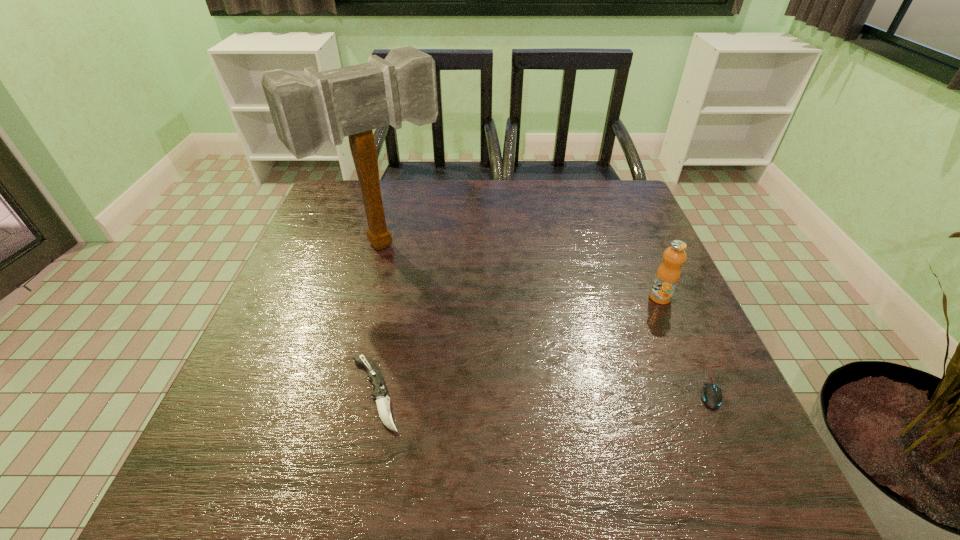
Where is `pocketknife`? The height and width of the screenshot is (540, 960). pocketknife is located at coordinates (380, 393).

Image resolution: width=960 pixels, height=540 pixels. I want to click on mouse, so click(x=712, y=397).

At what (x,y) coordinates should I click in order to perform the action: click on orange juice. Please return your answer as a coordinate pair (x, y). The image size is (960, 540). Looking at the image, I should click on (668, 274).

This screenshot has width=960, height=540. What are the coordinates of `the second farthest object` in the screenshot? It's located at (668, 274).

This screenshot has width=960, height=540. I want to click on the farthest object, so click(x=308, y=110).

At what (x,y) coordinates should I click in order to perform the action: click on the tallest object. Please return your answer as a coordinate pair (x, y). This screenshot has height=540, width=960. Looking at the image, I should click on (308, 110).

You are a GUI agent. You are given a task and a screenshot of the screen. Output one action in this format:
    pyautogui.click(x=<x>, y=<y>)
    Task: Click on the blank area located 0.060m on the left of the pocketknife
    Image resolution: width=960 pixels, height=540 pixels.
    Given the screenshot: What is the action you would take?
    pyautogui.click(x=313, y=394)

The image size is (960, 540). I want to click on blank space located 0.130m on the left of the mouse, so click(x=626, y=383).

Where is `vacant space located 0.120m on the front label of the second tallest object`? Image resolution: width=960 pixels, height=540 pixels. vacant space located 0.120m on the front label of the second tallest object is located at coordinates (616, 325).

The image size is (960, 540). I want to click on free space located 0.150m on the front label of the second tallest object, so click(x=607, y=330).